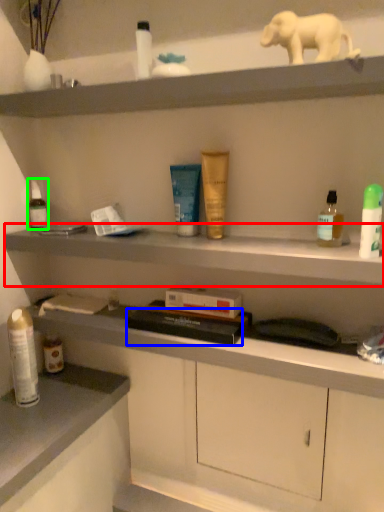
Question: Considering the real-world distances, which object is farthest from cabinet (highlighted by a red box)? book (highlighted by a blue box) or toiletry (highlighted by a green box)?

Choices:
 (A) book
 (B) toiletry

Answer: (B)